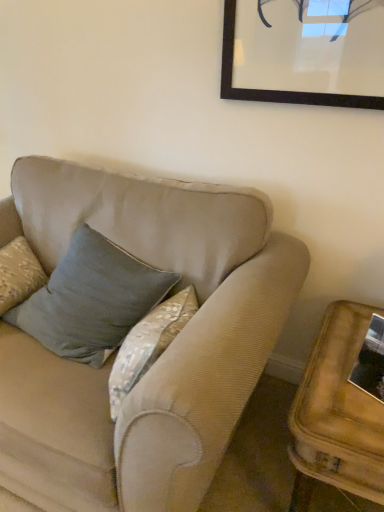
Question: Considering the relative positions of wooden side table at lower right and velvet blue pillow at center in the image provided, is wooden side table at lower right in front of velvet blue pillow at center?

Choices:
 (A) yes
 (B) no

Answer: (A)

Question: Is wooden side table at lower right in contact with velvet blue pillow at center?

Choices:
 (A) yes
 (B) no

Answer: (B)

Question: Would you say wooden side table at lower right is outside velvet blue pillow at center?

Choices:
 (A) no
 (B) yes

Answer: (B)

Question: Does wooden side table at lower right have a smaller size compared to velvet blue pillow at center?

Choices:
 (A) yes
 (B) no

Answer: (B)

Question: Can you confirm if wooden side table at lower right is thinner than velvet blue pillow at center?

Choices:
 (A) no
 (B) yes

Answer: (A)

Question: Can velvet blue pillow at center be found inside wooden side table at lower right?

Choices:
 (A) yes
 (B) no

Answer: (B)

Question: Is velvet blue pillow at center shorter than wooden side table at lower right?

Choices:
 (A) yes
 (B) no

Answer: (B)

Question: Is velvet blue pillow at center facing towards wooden side table at lower right?

Choices:
 (A) yes
 (B) no

Answer: (B)

Question: Does velvet blue pillow at center have a lesser width compared to wooden side table at lower right?

Choices:
 (A) no
 (B) yes

Answer: (B)

Question: Is velvet blue pillow at center next to wooden side table at lower right and touching it?

Choices:
 (A) no
 (B) yes

Answer: (A)

Question: From a real-world perspective, does velvet blue pillow at center sit lower than wooden side table at lower right?

Choices:
 (A) no
 (B) yes

Answer: (A)

Question: Considering the relative positions of velvet blue pillow at center and wooden side table at lower right in the image provided, is velvet blue pillow at center to the left of wooden side table at lower right from the viewer's perspective?

Choices:
 (A) no
 (B) yes

Answer: (B)

Question: Considering the relative sizes of wooden side table at lower right and metallic reflective frame at lower right in the image provided, is wooden side table at lower right bigger than metallic reflective frame at lower right?

Choices:
 (A) no
 (B) yes

Answer: (B)